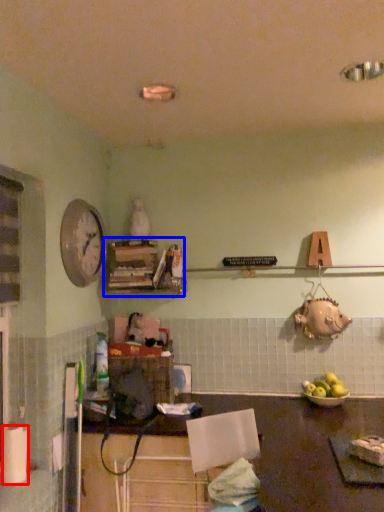
Question: Which of the following is the closest to the observer, paper towel (highlighted by a red box) or shelf (highlighted by a blue box)?

Choices:
 (A) paper towel
 (B) shelf

Answer: (A)